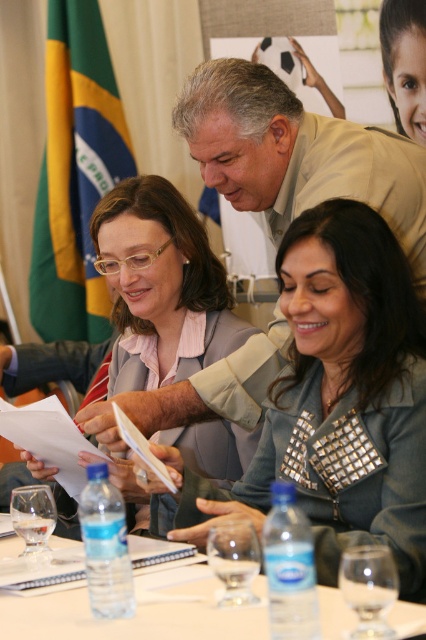
Does matte gray blazer at center have a larger size compared to clear plastic water bottles at lower center?

Correct, matte gray blazer at center is larger in size than clear plastic water bottles at lower center.

What do you see at coordinates (144, 298) in the screenshot? The image size is (426, 640). I see `matte gray blazer at center` at bounding box center [144, 298].

Identify the location of matte gray blazer at center. This screenshot has width=426, height=640. pyautogui.click(x=144, y=298).

Who is taller, satin gray blazer at center or green fabric flag at upper left?

green fabric flag at upper left is taller.

Between satin gray blazer at center and green fabric flag at upper left, which one is positioned lower?

Positioned lower is satin gray blazer at center.

Who is more distant from viewer, (354, 476) or (42, 289)?

Point (42, 289)

This screenshot has width=426, height=640. Identify the location of satin gray blazer at center. (344, 396).

Does matte gray blazer at center appear on the right side of beige textured suit at upper center?

In fact, matte gray blazer at center is to the left of beige textured suit at upper center.

Does matte gray blazer at center have a greater width compared to beige textured suit at upper center?

No.

Locate an element on the screen. The image size is (426, 640). matte gray blazer at center is located at coordinates (144, 298).